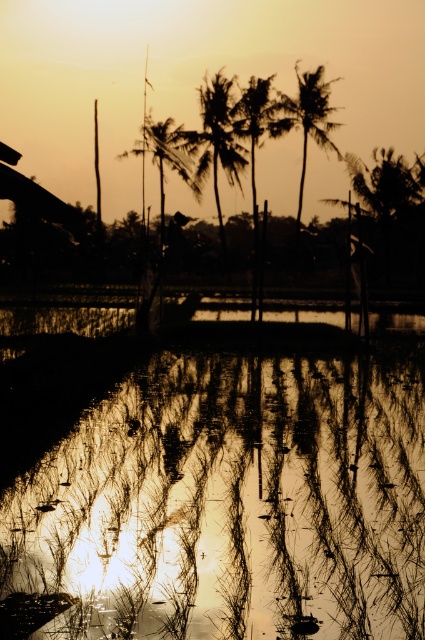
Question: Which point appears closest to the camera in this image?

Choices:
 (A) (226, 141)
 (B) (325, 92)
 (C) (167, 156)

Answer: (C)

Question: Which point is closer to the camera?

Choices:
 (A) shiny reflective water at center
 (B) silhouette palm tree at upper center
 (C) silky green palm tree at center
 (D) silhouette palm tree at center

Answer: (A)

Question: Does shiny reflective water at center lie in front of silhouette palm tree at upper center?

Choices:
 (A) yes
 (B) no

Answer: (A)

Question: Can you confirm if shiny reflective water at center is wider than silhouette palm tree at center?

Choices:
 (A) no
 (B) yes

Answer: (B)

Question: Is silhouette palm tree at upper center bigger than silky green palm tree at center?

Choices:
 (A) no
 (B) yes

Answer: (A)

Question: Which point appears closest to the camera in this image?

Choices:
 (A) (19, 624)
 (B) (297, 211)

Answer: (A)